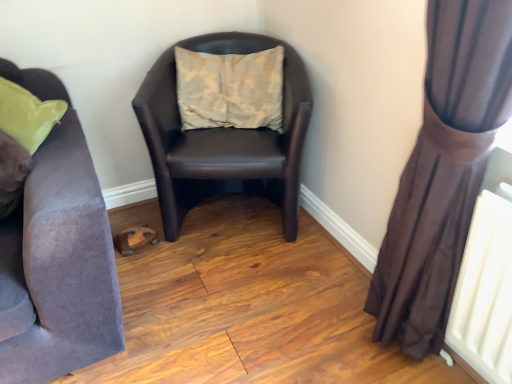
This screenshot has width=512, height=384. I want to click on velvet purple couch at left, so click(x=59, y=265).

What do you see at coordinates (59, 265) in the screenshot?
I see `velvet purple couch at left` at bounding box center [59, 265].

Image resolution: width=512 pixels, height=384 pixels. Identify the location of brown sheer curtain at right. (443, 172).

Measure the distance between point (251, 61) and camera.

5.82 feet.

Describe the element at coordinates (230, 89) in the screenshot. The width and height of the screenshot is (512, 384). I see `beige fabric pillow at center` at that location.

The height and width of the screenshot is (384, 512). What are the coordinates of `velvet purple couch at left` in the screenshot? It's located at (59, 265).

Does brown sheer curtain at right have a smaller size compared to velvet purple couch at left?

Yes.

Considering the relative positions of brown sheer curtain at right and velvet purple couch at left in the image provided, is brown sheer curtain at right to the left of velvet purple couch at left from the viewer's perspective?

Incorrect, brown sheer curtain at right is not on the left side of velvet purple couch at left.

Which object is further away from the camera, brown sheer curtain at right or velvet purple couch at left?

velvet purple couch at left.

How far apart are brown sheer curtain at right and velvet purple couch at left?

brown sheer curtain at right is 36.71 inches away from velvet purple couch at left.

Can you tell me how much velvet purple couch at left and brown leather chair at center differ in facing direction?

7.15 degrees.

From a real-world perspective, which object rests below the other?

From a 3D spatial view, brown leather chair at center is below.

Locate an element on the screen. studio couch lying in front of the brown leather chair at center is located at coordinates (59, 265).

Who is shorter, beige fabric pillow at center or velvet purple couch at left?

beige fabric pillow at center is shorter.

Does beige fabric pillow at center come behind velvet purple couch at left?

Result: That is True.

Where is `studio couch above the beige fabric pillow at center (from a real-world perspective)`? The width and height of the screenshot is (512, 384). studio couch above the beige fabric pillow at center (from a real-world perspective) is located at coordinates (59, 265).

Is beige fabric pillow at center to the right of velvet purple couch at left from the viewer's perspective?

Indeed, beige fabric pillow at center is positioned on the right side of velvet purple couch at left.

Find the location of `curtain below the brown leather chair at center (from the image's perspective)`. curtain below the brown leather chair at center (from the image's perspective) is located at coordinates (443, 172).

From the picture: Between brown leather chair at center and brown sheer curtain at right, which one is positioned in front?

Positioned in front is brown sheer curtain at right.

In the scene shown: Between brown leather chair at center and brown sheer curtain at right, which one has less height?

Standing shorter between the two is brown leather chair at center.

Is brown leather chair at center at the right side of brown sheer curtain at right?

No, brown leather chair at center is not to the right of brown sheer curtain at right.

Can you confirm if brown sheer curtain at right is bigger than brown leather chair at center?

No.

Considering the sizes of objects brown sheer curtain at right and brown leather chair at center in the image provided, who is taller, brown sheer curtain at right or brown leather chair at center?

brown sheer curtain at right.

From the image's perspective, which object appears higher, brown sheer curtain at right or brown leather chair at center?

brown leather chair at center is shown above in the image.

Which object is wider, brown sheer curtain at right or beige fabric pillow at center?

With larger width is beige fabric pillow at center.

How many degrees apart are the facing directions of brown sheer curtain at right and beige fabric pillow at center?

brown sheer curtain at right and beige fabric pillow at center are facing 63.7 degrees away from each other.

Between brown sheer curtain at right and beige fabric pillow at center, which one is positioned in front?

brown sheer curtain at right is more forward.

Is brown sheer curtain at right oriented towards beige fabric pillow at center?

No, brown sheer curtain at right does not turn towards beige fabric pillow at center.

Find the location of a particular element. The width and height of the screenshot is (512, 384). studio couch to the left of brown sheer curtain at right is located at coordinates (59, 265).

What's the angular difference between velvet purple couch at left and brown sheer curtain at right's facing directions?

The angular difference between velvet purple couch at left and brown sheer curtain at right is 68.4 degrees.

Would you say velvet purple couch at left is to the left or to the right of brown sheer curtain at right in the picture?

Clearly, velvet purple couch at left is on the left of brown sheer curtain at right in the image.

Is velvet purple couch at left placed right next to brown sheer curtain at right?

No, velvet purple couch at left is not touching brown sheer curtain at right.

What are the coordinates of `studio couch behind the brown sheer curtain at right` in the screenshot? It's located at (59, 265).

What are the coordinates of `rocking chair located underneath the velvet purple couch at left (from a real-world perspective)` in the screenshot? It's located at (223, 137).

Looking at the image, which one is located further to brown sheer curtain at right, brown leather chair at center or velvet purple couch at left?

The object further to brown sheer curtain at right is velvet purple couch at left.

Based on the photo, based on their spatial positions, is velvet purple couch at left or brown sheer curtain at right closer to beige fabric pillow at center?

The object closer to beige fabric pillow at center is velvet purple couch at left.

When comparing their distances from brown sheer curtain at right, does beige fabric pillow at center or velvet purple couch at left seem further?

velvet purple couch at left.

Based on their spatial positions, is velvet purple couch at left or brown sheer curtain at right closer to brown leather chair at center?

velvet purple couch at left lies closer to brown leather chair at center than the other object.

Based on their spatial positions, is brown leather chair at center or beige fabric pillow at center closer to velvet purple couch at left?

Based on the image, brown leather chair at center appears to be nearer to velvet purple couch at left.

When comparing their distances from velvet purple couch at left, does brown sheer curtain at right or brown leather chair at center seem further?

brown sheer curtain at right lies further to velvet purple couch at left than the other object.

Considering their positions, is brown leather chair at center positioned closer to velvet purple couch at left than brown sheer curtain at right?

brown leather chair at center is positioned closer to the anchor velvet purple couch at left.

Which object lies further to the anchor point velvet purple couch at left, brown sheer curtain at right or beige fabric pillow at center?

brown sheer curtain at right.

At what (x,y) coordinates should I click in order to perform the action: click on rocking chair located between brown sheer curtain at right and beige fabric pillow at center in the depth direction. Please return your answer as a coordinate pair (x, y). This screenshot has height=384, width=512. Looking at the image, I should click on (223, 137).

Find the location of a particular element. The width and height of the screenshot is (512, 384). rocking chair between velvet purple couch at left and brown sheer curtain at right is located at coordinates (223, 137).

At what (x,y) coordinates should I click in order to perform the action: click on pillow situated between velvet purple couch at left and brown sheer curtain at right from left to right. Please return your answer as a coordinate pair (x, y). The width and height of the screenshot is (512, 384). Looking at the image, I should click on (230, 89).

Identify the location of rocking chair between velvet purple couch at left and beige fabric pillow at center from left to right. (223, 137).